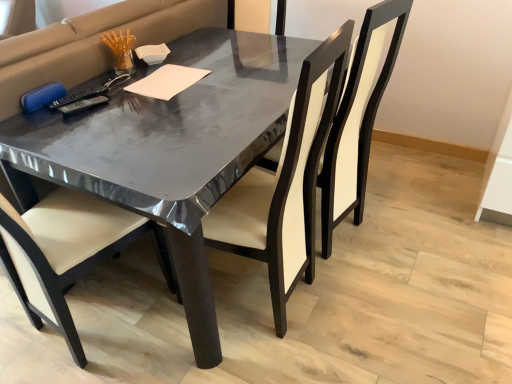
Find the location of a particular element. free area below white paper at center (from a real-world perspective) is located at coordinates click(x=174, y=82).